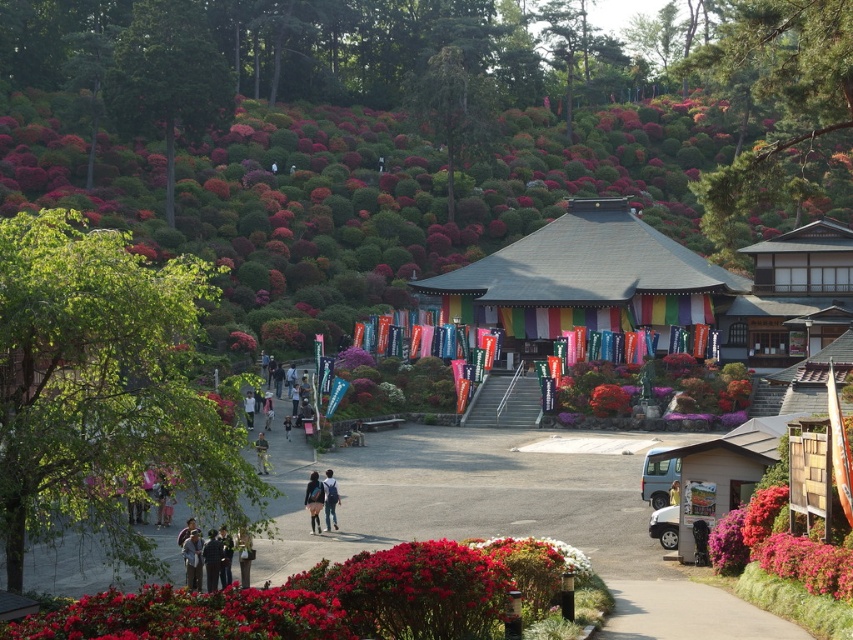
You are standing at the entrance of the temple and want to take a photo of the green leafy tree at upper left and the glossy red bush at lower center. Which object should you adjust your camera to focus on first if you want to include both in the frame without moving your position?

You should focus on the green leafy tree at upper left first because it is located to the left of the glossy red bush at lower center, allowing you to frame both by adjusting the camera angle from left to right.

You are standing in the temple area and want to take a photo of both the point at coordinates (x=625, y=394) and the point at (x=242, y=550). Based on their positions, which point will appear closer to the camera in your photo?

Point (x=242, y=550) will appear closer to the camera in the photo because it is physically closer to the camera than point (x=625, y=394), which is further away.